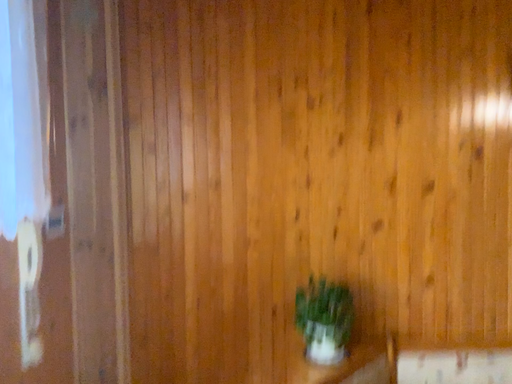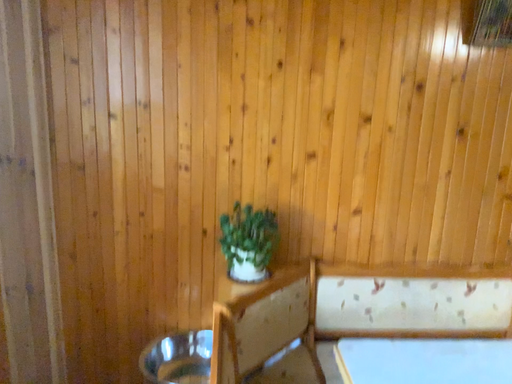
Question: How did the camera likely rotate when shooting the video?

Choices:
 (A) rotated downward
 (B) rotated upward

Answer: (A)